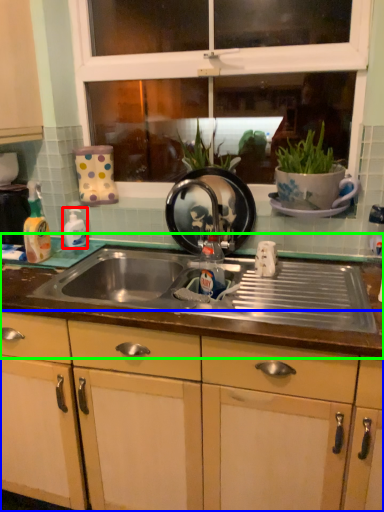
Question: Which object is the farthest from bottle (highlighted by a red box)? Choose among these: cabinetry (highlighted by a blue box) or countertop (highlighted by a green box).

Choices:
 (A) cabinetry
 (B) countertop

Answer: (A)